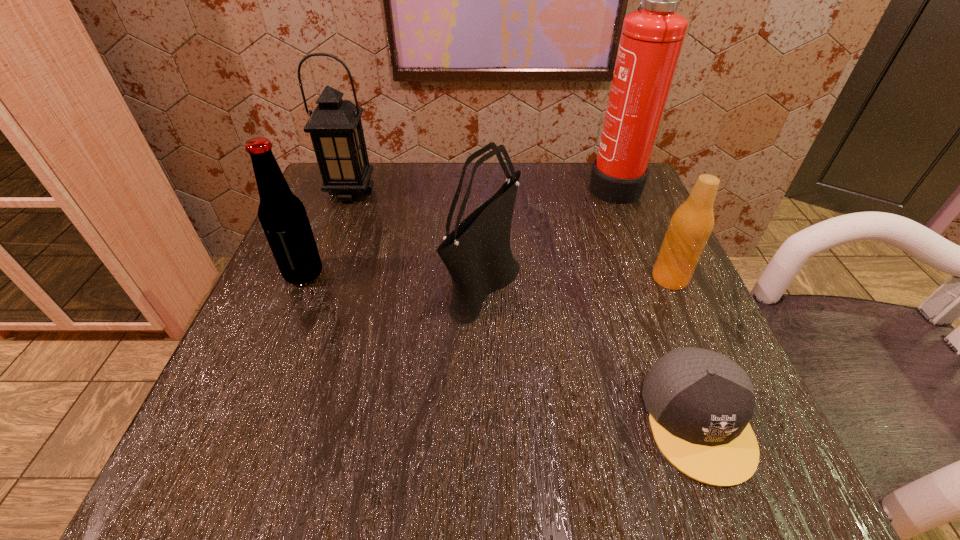
This screenshot has width=960, height=540. Find the location of `vacant point located 0.050m on the front-facing side of the fire extinguisher`. vacant point located 0.050m on the front-facing side of the fire extinguisher is located at coordinates (564, 184).

This screenshot has width=960, height=540. In order to click on vacant space situated 0.080m on the back of the lantern in this screenshot , I will do `click(362, 163)`.

In order to click on free point located 0.150m on the front of the shoulder bag in this screenshot , I will do coord(485,415).

Where is `vacant space located 0.310m on the front of the taller beer bottle`? The height and width of the screenshot is (540, 960). vacant space located 0.310m on the front of the taller beer bottle is located at coordinates (226, 463).

I want to click on vacant space located 0.060m on the back of the shorter beer bottle, so click(656, 245).

Where is `fire extinguisher that is at the far edge`? Image resolution: width=960 pixels, height=540 pixels. fire extinguisher that is at the far edge is located at coordinates (651, 39).

You are a GUI agent. You are given a task and a screenshot of the screen. Output one action in this format:
    pyautogui.click(x=<x>, y=<y>)
    Task: Click on the lantern that is positioned at the far edge
    This screenshot has width=960, height=540.
    Given the screenshot: What is the action you would take?
    pyautogui.click(x=335, y=127)

In order to click on object that is positioned at the near edge in this screenshot , I will do [x=700, y=402].

The width and height of the screenshot is (960, 540). Identify the location of lantern present at the left edge. (335, 127).

Where is `beer bottle located in the left edge section of the desktop`? The image size is (960, 540). beer bottle located in the left edge section of the desktop is located at coordinates (282, 215).